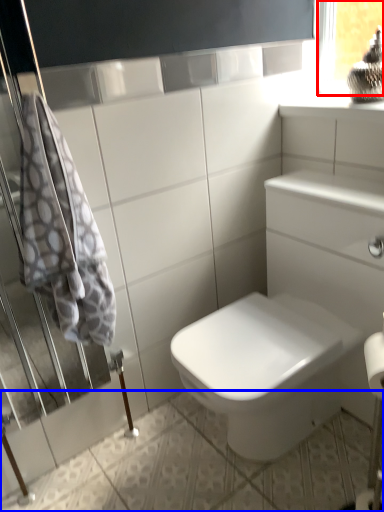
Question: Which of the following is the farthest to the observer, window frame (highlighted by a red box) or ceramic tile (highlighted by a blue box)?

Choices:
 (A) window frame
 (B) ceramic tile

Answer: (A)